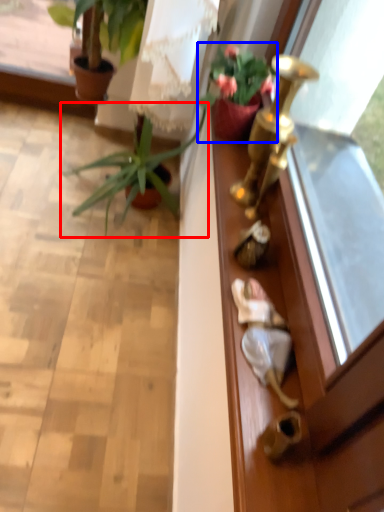
Question: Which object is closer to the camera taking this photo, houseplant (highlighted by a red box) or houseplant (highlighted by a blue box)?

Choices:
 (A) houseplant
 (B) houseplant

Answer: (B)